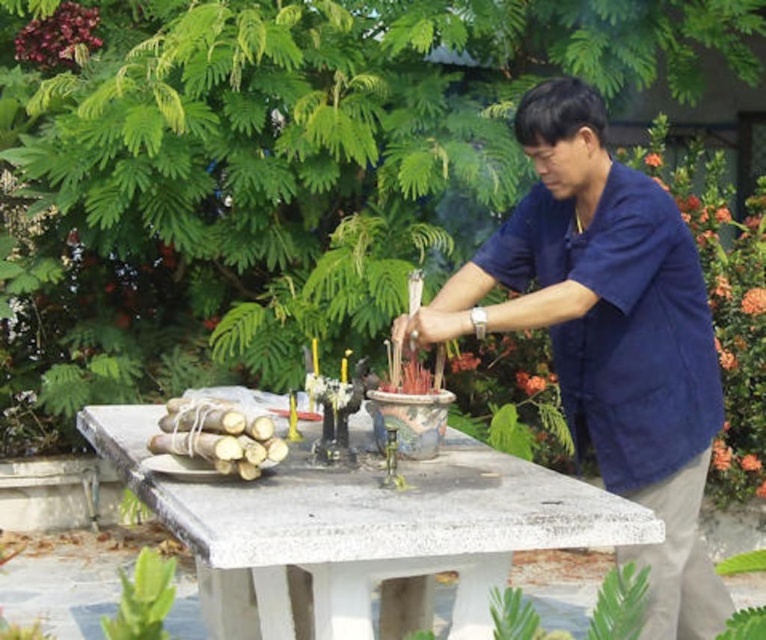
Does point (583, 369) come farther from viewer compared to point (264, 541)?

That is True.

Which is behind, point (624, 182) or point (424, 502)?

Positioned behind is point (624, 182).

Where is `blue cotton shirt at center`? blue cotton shirt at center is located at coordinates (607, 333).

Does white concrete table at center have a smaller size compared to natural bamboo sticks at left?

Actually, white concrete table at center might be larger than natural bamboo sticks at left.

Is point (214, 531) farther from camera compared to point (165, 429)?

That is False.

Who is more forward, (218,563) or (257,474)?

Point (218,563)

In order to click on white concrete table at center in this screenshot , I will do `click(362, 532)`.

Can you confirm if blue cotton shirt at center is positioned above natural bamboo sticks at left?

Correct, blue cotton shirt at center is located above natural bamboo sticks at left.

Who is taller, blue cotton shirt at center or natural bamboo sticks at left?

blue cotton shirt at center is taller.

In order to click on blue cotton shirt at center in this screenshot , I will do `click(607, 333)`.